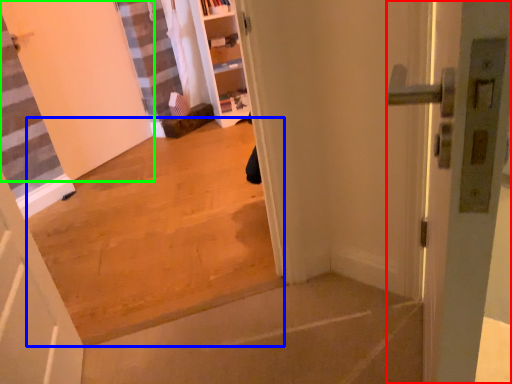
Question: Which is nearer to the door (highlighted by a red box)? concrete (highlighted by a blue box) or door (highlighted by a green box).

Choices:
 (A) concrete
 (B) door

Answer: (A)